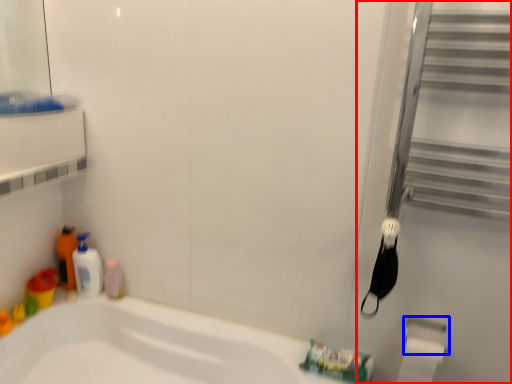
Question: Which of the following is the closest to the observer, screen door (highlighted by a red box) or towel bar (highlighted by a blue box)?

Choices:
 (A) screen door
 (B) towel bar

Answer: (A)